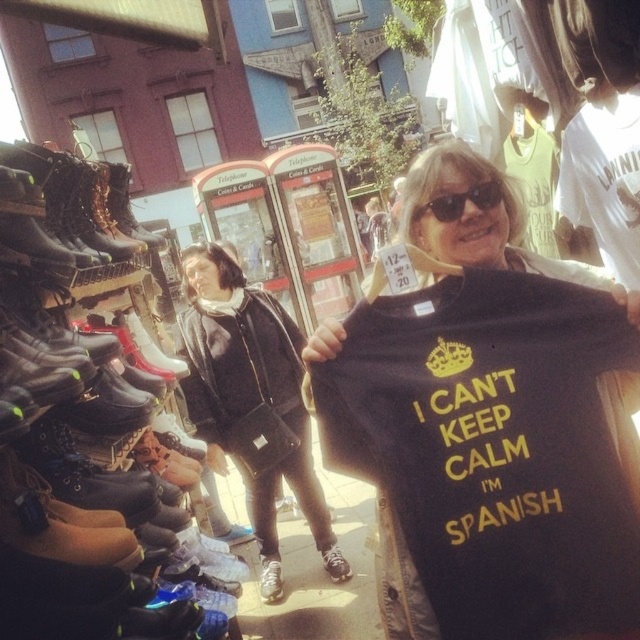
Question: Which object is the farthest from the leather sneaker at lower center?

Choices:
 (A) black leather jacket at center
 (B) white leather sneaker at lower center
 (C) black plastic sunglasses at upper center

Answer: (C)

Question: Is leather boots at left wider than black leather jacket at center?

Choices:
 (A) no
 (B) yes

Answer: (A)

Question: Which object is closer to the camera taking this photo?

Choices:
 (A) leather sneaker at lower center
 (B) black leather jacket at center
 (C) suede-like brown shoe at lower left
 (D) leather boots at left

Answer: (D)

Question: Is black plastic sunglasses at upper center further to the viewer compared to suede-like brown shoe at lower left?

Choices:
 (A) yes
 (B) no

Answer: (B)

Question: Estimate the real-world distances between objects in this image. Which object is farther from the black matte t-shirt at center?

Choices:
 (A) black leather jacket at center
 (B) leather boots at left

Answer: (A)

Question: Does black matte t-shirt at center have a lesser width compared to white leather sneaker at lower center?

Choices:
 (A) yes
 (B) no

Answer: (B)